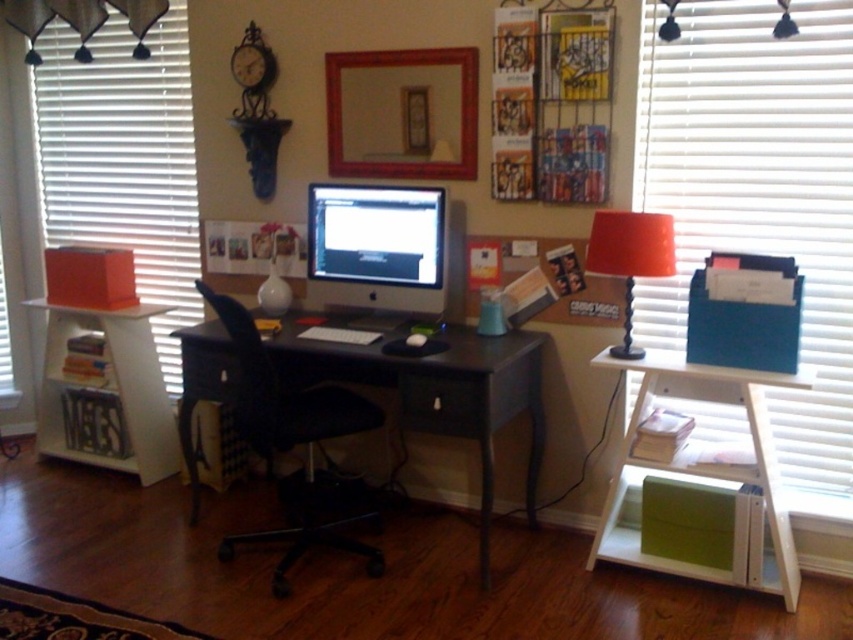
Is point (146, 131) closer to camera compared to point (798, 381)?

That is False.

Based on the photo, between white blinds at left and white glossy table at right, which one appears on the right side from the viewer's perspective?

From the viewer's perspective, white glossy table at right appears more on the right side.

Identify the location of white blinds at left. (123, 157).

Locate an element on the screen. white blinds at left is located at coordinates (123, 157).

Which is more to the left, white glossy table at right or orange fabric lampshade at right?

orange fabric lampshade at right is more to the left.

Who is higher up, white glossy table at right or orange fabric lampshade at right?

orange fabric lampshade at right

Locate an element on the screen. The image size is (853, 640). white glossy table at right is located at coordinates coord(704,477).

Which is in front, point (759, 483) or point (403, 241)?

Positioned in front is point (759, 483).

Looking at this image, does white glossy table at right have a smaller size compared to satin black monitor at center?

No.

What do you see at coordinates (704, 477) in the screenshot? I see `white glossy table at right` at bounding box center [704, 477].

Image resolution: width=853 pixels, height=640 pixels. I want to click on white glossy table at right, so click(704, 477).